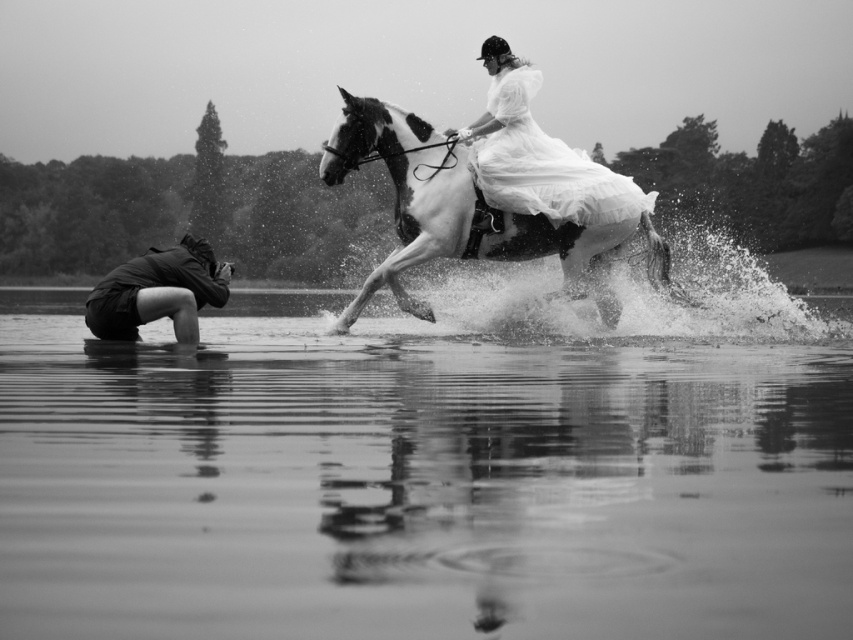
Question: Considering the relative positions of white glossy horse at center and white satin dress at upper center in the image provided, where is white glossy horse at center located with respect to white satin dress at upper center?

Choices:
 (A) above
 (B) below

Answer: (B)

Question: Which of the following is the closest to the observer?

Choices:
 (A) white satin dress at upper center
 (B) white glossy horse at center
 (C) dark gray fabric camera at lower left

Answer: (C)

Question: Is white glossy horse at center in front of white satin dress at upper center?

Choices:
 (A) yes
 (B) no

Answer: (B)

Question: Is smooth water at lower center below white glossy horse at center?

Choices:
 (A) no
 (B) yes

Answer: (B)

Question: Among these objects, which one is nearest to the camera?

Choices:
 (A) dark gray fabric camera at lower left
 (B) smooth water at lower center
 (C) white satin dress at upper center

Answer: (B)

Question: Which object appears farthest from the camera in this image?

Choices:
 (A) white satin dress at upper center
 (B) dark gray fabric camera at lower left
 (C) smooth water at lower center
 (D) white glossy horse at center

Answer: (D)